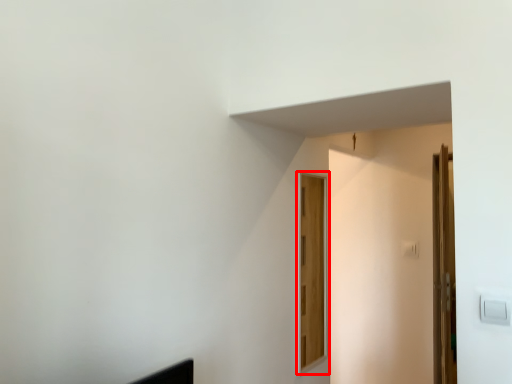
Question: From the image, what is the correct spatial relationship of door (annotated by the red box) in relation to door?

Choices:
 (A) right
 (B) left

Answer: (B)